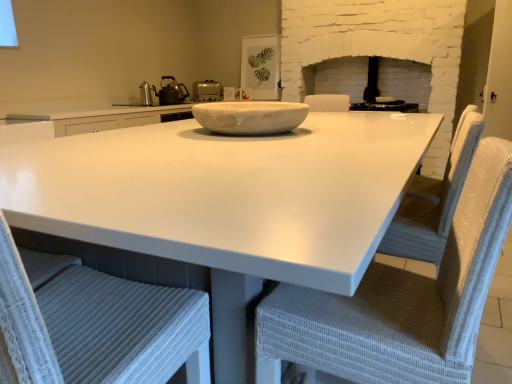
Question: Is white wicker chair at center, placed as the first chair when sorted from right to left, in front of or behind white glossy countertop at center in the image?

Choices:
 (A) behind
 (B) front

Answer: (A)

Question: Considering the positions of point (404, 372) and point (238, 259), is point (404, 372) closer or farther from the camera than point (238, 259)?

Choices:
 (A) farther
 (B) closer

Answer: (A)

Question: Which object is positioned farthest from the white wicker chair at lower left, acting as the 1th chair starting from the left?

Choices:
 (A) black plastic toaster at upper center
 (B) white wicker chair at center, placed as the first chair when sorted from right to left
 (C) white matte toaster at upper center
 (D) white glossy countertop at center
 (E) white marble bowl at center

Answer: (C)

Question: Which of these objects is positioned closest to the white glossy countertop at center?

Choices:
 (A) black plastic toaster at upper center
 (B) white wicker chair at lower left, acting as the 1th chair starting from the left
 (C) white wicker chair at center, placed as the first chair when sorted from right to left
 (D) white matte toaster at upper center
 (E) shiny black tea pot at upper left

Answer: (C)